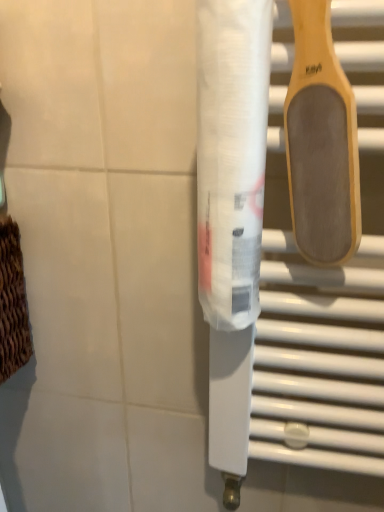
Question: Should I look upward or downward to see wooden/textured spatula at upper right?

Choices:
 (A) down
 (B) up

Answer: (B)

Question: Could wooden/textured spatula at upper right be considered to be inside transparent plastic toilet paper at center?

Choices:
 (A) no
 (B) yes

Answer: (A)

Question: Does transparent plastic toilet paper at center have a larger size compared to wooden/textured spatula at upper right?

Choices:
 (A) no
 (B) yes

Answer: (B)

Question: Can you confirm if transparent plastic toilet paper at center is taller than wooden/textured spatula at upper right?

Choices:
 (A) yes
 (B) no

Answer: (A)

Question: Is transparent plastic toilet paper at center facing away from wooden/textured spatula at upper right?

Choices:
 (A) no
 (B) yes

Answer: (A)

Question: From the image's perspective, is transparent plastic toilet paper at center beneath wooden/textured spatula at upper right?

Choices:
 (A) yes
 (B) no

Answer: (A)

Question: Does transparent plastic toilet paper at center have a lesser height compared to wooden/textured spatula at upper right?

Choices:
 (A) yes
 (B) no

Answer: (B)

Question: From a real-world perspective, does wooden/textured spatula at upper right sit lower than transparent plastic toilet paper at center?

Choices:
 (A) yes
 (B) no

Answer: (B)

Question: Is wooden/textured spatula at upper right oriented towards transparent plastic toilet paper at center?

Choices:
 (A) no
 (B) yes

Answer: (A)

Question: Can you confirm if wooden/textured spatula at upper right is shorter than transparent plastic toilet paper at center?

Choices:
 (A) no
 (B) yes

Answer: (B)

Question: Considering the relative positions of wooden/textured spatula at upper right and transparent plastic toilet paper at center in the image provided, is wooden/textured spatula at upper right to the left of transparent plastic toilet paper at center from the viewer's perspective?

Choices:
 (A) yes
 (B) no

Answer: (B)

Question: Is wooden/textured spatula at upper right behind transparent plastic toilet paper at center?

Choices:
 (A) no
 (B) yes

Answer: (A)

Question: Is wooden/textured spatula at upper right to the right of transparent plastic toilet paper at center from the viewer's perspective?

Choices:
 (A) no
 (B) yes

Answer: (B)

Question: Is transparent plastic toilet paper at center inside the boundaries of wooden/textured spatula at upper right, or outside?

Choices:
 (A) inside
 (B) outside

Answer: (B)